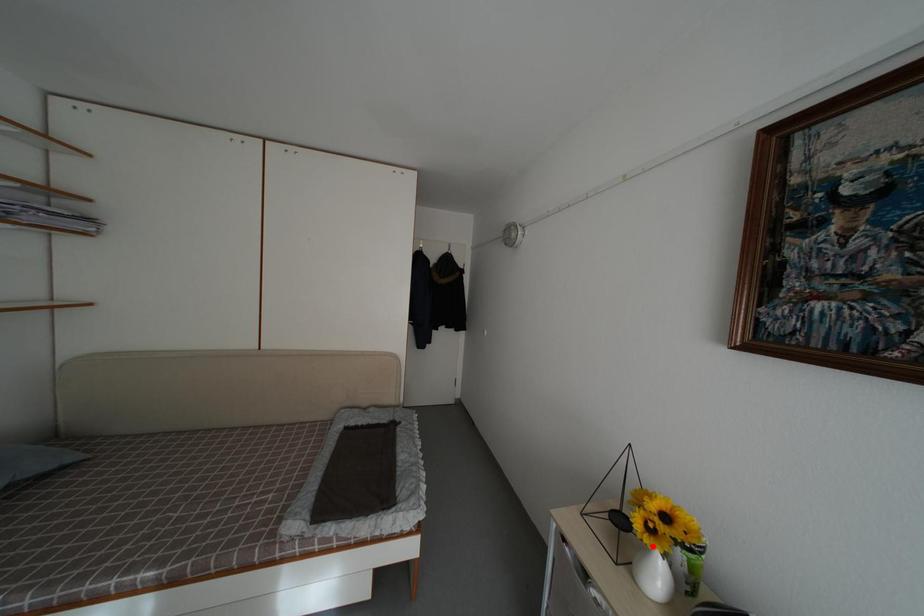
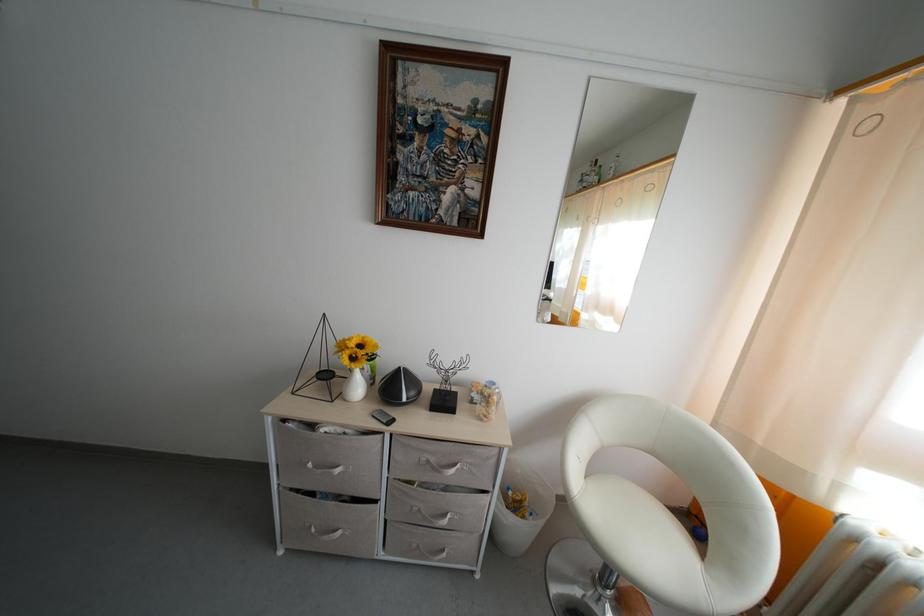
The point at the highlighted location is marked in the first image. Where is the corresponding point in the second image?

(359, 371)